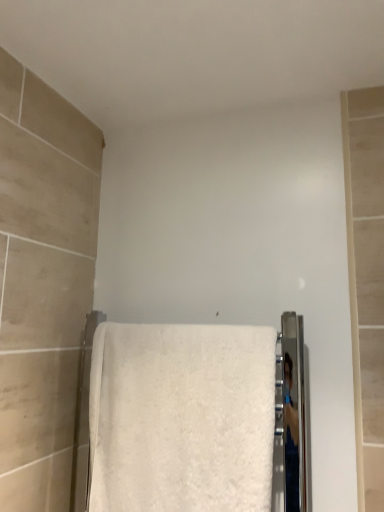
This screenshot has width=384, height=512. Describe the element at coordinates (182, 418) in the screenshot. I see `white fluffy towel at center` at that location.

I want to click on white fluffy towel at center, so click(182, 418).

Find the location of `white fluffy towel at center`. white fluffy towel at center is located at coordinates (182, 418).